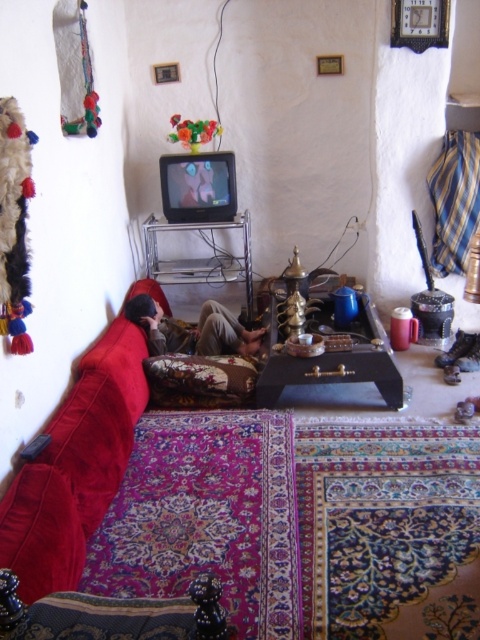
You are standing in the living room and want to place a decorative item between the velvet red couch at lower left and the floral fabric pillow at center. Based on their positions, where should you position the item?

The velvet red couch at lower left is to the left of the floral fabric pillow at center, so you should place the decorative item in between them, ensuring it is positioned to the right of the velvet red couch at lower left and to the left of the floral fabric pillow at center.

You are standing in the living room and want to take a photo of the point at coordinates (x=139, y=355). The camera you are using has a minimum focus distance of 10 feet. Will the camera be able to focus on the point?

The point at coordinates (x=139, y=355) is 9.79 feet away from the camera, which is within the camera minimum focus distance of 10 feet. Therefore, the camera can focus on the point.